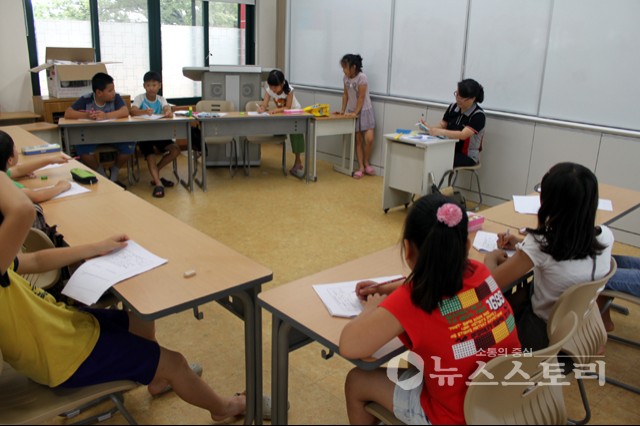
At what (x,y) coordinates should I click in order to perform the action: click on whiteboard. Please return your answer as a coordinate pair (x, y). This screenshot has height=426, width=640. Looking at the image, I should click on (518, 54).